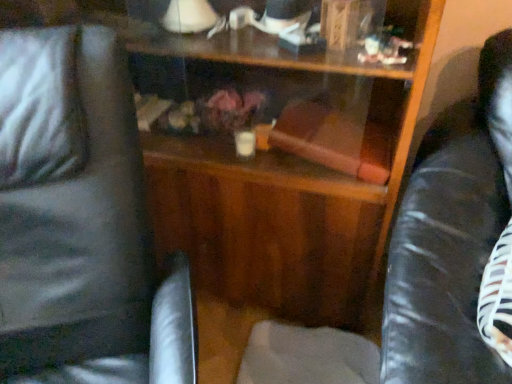
Question: Considering their positions, is black leather swivel chair at left, which is counted as the 2th swivel chair, starting from the right, located in front of or behind black leather swivel chair at right, the 2th swivel chair when ordered from left to right?

Choices:
 (A) front
 (B) behind

Answer: (A)

Question: Is black leather swivel chair at left, marked as the 1th swivel chair in a left-to-right arrangement, bigger or smaller than black leather swivel chair at right, the first swivel chair viewed from the right?

Choices:
 (A) big
 (B) small

Answer: (A)

Question: From a real-world perspective, is black leather swivel chair at left, marked as the 1th swivel chair in a left-to-right arrangement, positioned above or below black leather swivel chair at right, the first swivel chair viewed from the right?

Choices:
 (A) below
 (B) above

Answer: (A)

Question: Does point (485, 241) appear closer or farther from the camera than point (136, 130)?

Choices:
 (A) farther
 (B) closer

Answer: (A)

Question: Is black leather swivel chair at right, the first swivel chair viewed from the right, wider or thinner than black leather swivel chair at left, which is counted as the 2th swivel chair, starting from the right?

Choices:
 (A) thin
 (B) wide

Answer: (A)

Question: In the image, is black leather swivel chair at right, the 2th swivel chair when ordered from left to right, on the left side or the right side of black leather swivel chair at left, which is counted as the 2th swivel chair, starting from the right?

Choices:
 (A) right
 (B) left

Answer: (A)

Question: Is black leather swivel chair at right, the first swivel chair viewed from the right, in front of or behind black leather swivel chair at left, which is counted as the 2th swivel chair, starting from the right, in the image?

Choices:
 (A) behind
 (B) front

Answer: (A)